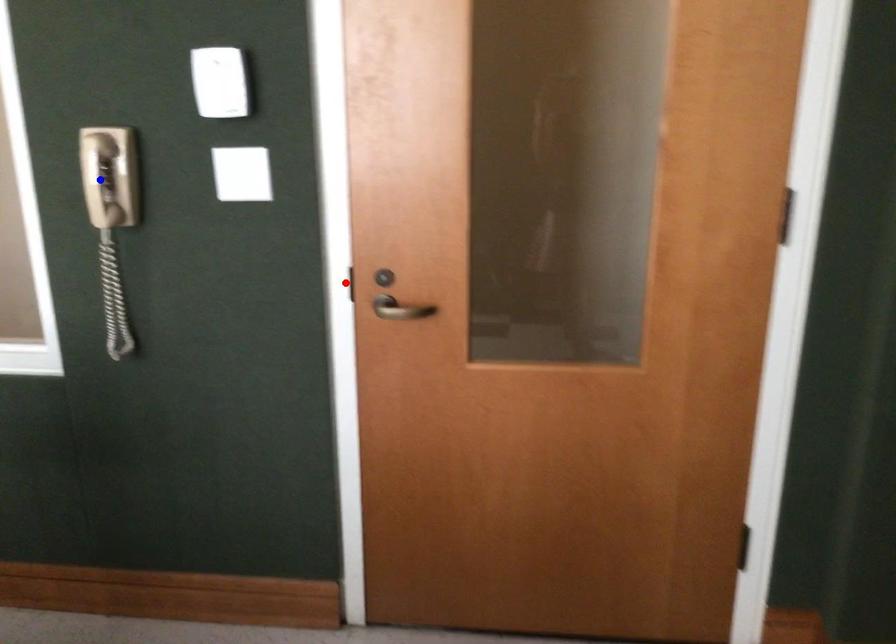
Question: In the image, two points are highlighted. Which point is nearer to the camera? Reply with the corresponding letter.

Choices:
 (A) blue point
 (B) red point

Answer: (A)